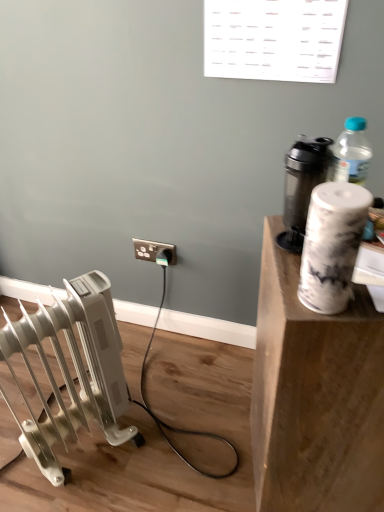
Identify the location of vacant space that's between white marble cup at upper right and white plastic radiator at lower left. (181, 457).